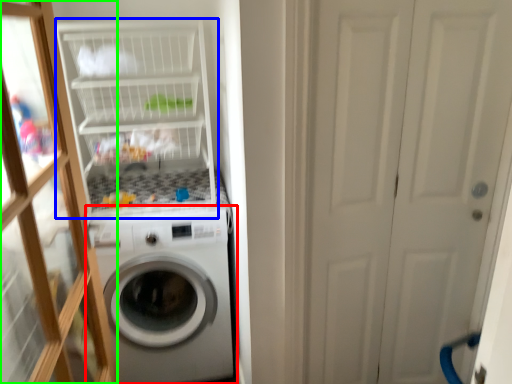
Question: Which is farther away from washing machine (highlighted by a red box)? shelf (highlighted by a blue box) or glass door (highlighted by a green box)?

Choices:
 (A) shelf
 (B) glass door

Answer: (B)